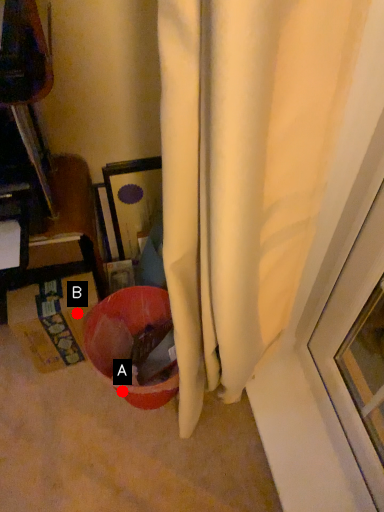
Question: Two points are circled on the image, labeled by A and B beside each circle. Which point is further to the camera?

Choices:
 (A) A is further
 (B) B is further

Answer: (B)